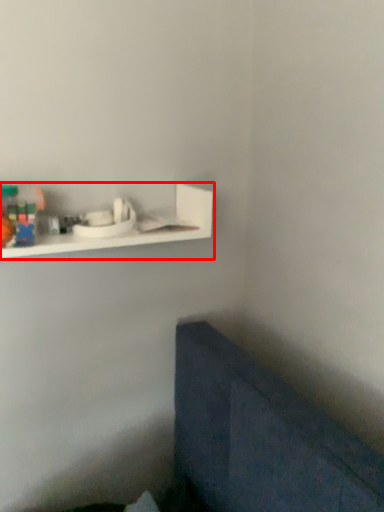
Question: Considering the relative positions of shelf (annotated by the red box) and toy in the image provided, where is shelf (annotated by the red box) located with respect to the staircase?

Choices:
 (A) right
 (B) left

Answer: (A)